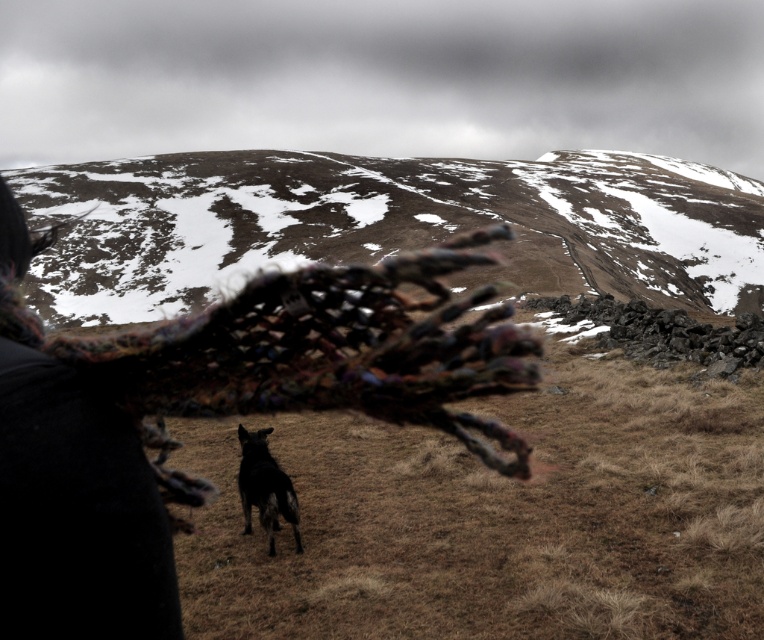
Which of these two, snowy brown mountain at upper center or multicolored knitted shawl at center, stands taller?

snowy brown mountain at upper center

Does snowy brown mountain at upper center have a larger size compared to multicolored knitted shawl at center?

Indeed, snowy brown mountain at upper center has a larger size compared to multicolored knitted shawl at center.

At what (x,y) coordinates should I click in order to perform the action: click on snowy brown mountain at upper center. Please return your answer as a coordinate pair (x, y). The height and width of the screenshot is (640, 764). Looking at the image, I should click on (384, 225).

Who is more forward, (245,336) or (264,490)?

Point (245,336) is more forward.

Is point (345, 340) closer to camera compared to point (274, 490)?

Yes, it is.

At what (x,y) coordinates should I click in order to perform the action: click on multicolored knitted shawl at center. Please return your answer as a coordinate pair (x, y). The height and width of the screenshot is (640, 764). Looking at the image, I should click on (312, 355).

Does snowy brown mountain at upper center appear on the left side of black fur dog at center?

In fact, snowy brown mountain at upper center is to the right of black fur dog at center.

Is snowy brown mountain at upper center positioned behind black fur dog at center?

No, it is in front of black fur dog at center.

Between point (526, 227) and point (261, 515), which one is positioned behind?

Point (526, 227)

Locate an element on the screen. This screenshot has height=640, width=764. snowy brown mountain at upper center is located at coordinates (384, 225).